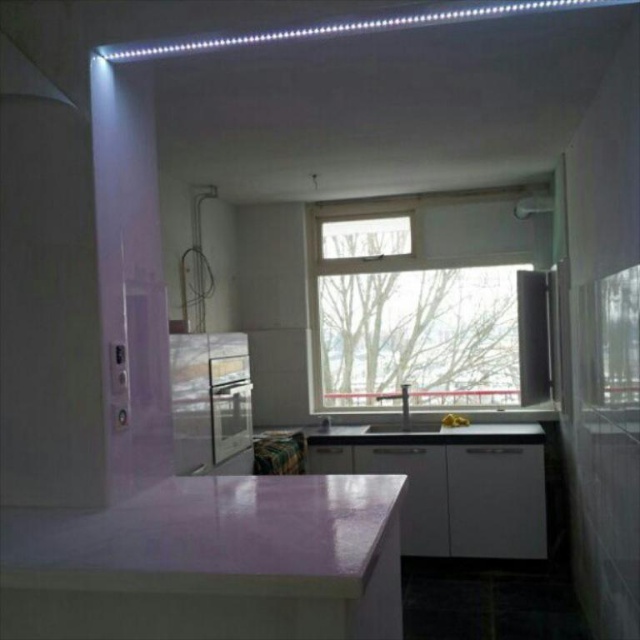
Question: Which point is closer to the camera?

Choices:
 (A) metallic stainless steel sink at center
 (B) transparent glass window at center
 (C) pink glossy countertop at lower center

Answer: (C)

Question: Which object appears farthest from the camera in this image?

Choices:
 (A) white glossy sink at center
 (B) pink glossy countertop at lower center

Answer: (A)

Question: Can you confirm if metallic stainless steel sink at center is smaller than matte white exhaust hood at upper left?

Choices:
 (A) no
 (B) yes

Answer: (A)

Question: Is metallic stainless steel sink at center above matte white exhaust hood at upper left?

Choices:
 (A) yes
 (B) no

Answer: (B)

Question: Which point is closer to the camera?

Choices:
 (A) (435, 428)
 (B) (179, 465)
 (C) (6, 88)
 (D) (372, 337)

Answer: (C)

Question: Is metallic stainless steel sink at center bigger than matte white exhaust hood at upper left?

Choices:
 (A) yes
 (B) no

Answer: (A)